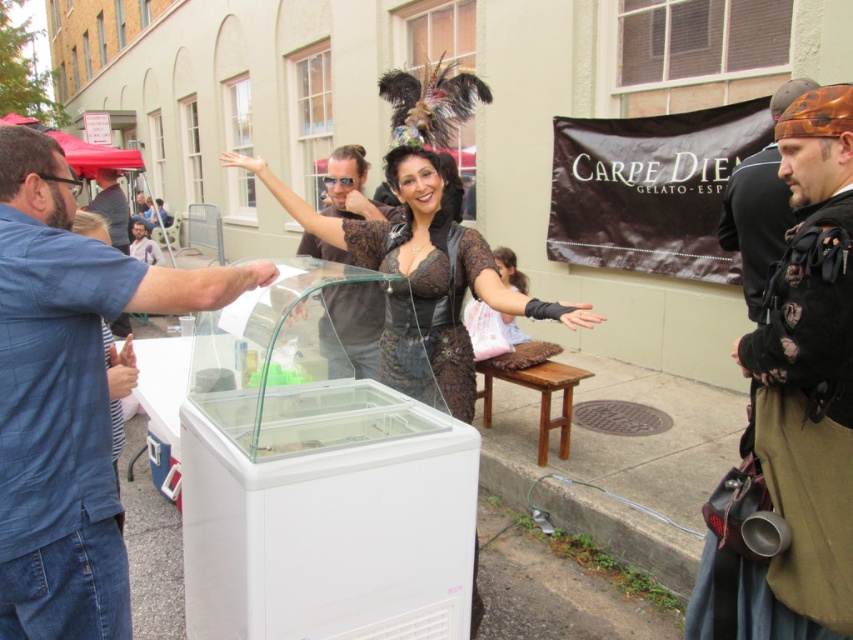
You are standing at the gelato stand and want to reach a point that is 10.69 feet away from you. The coordinates of this point are given as point (250, 170). Can you confirm if this point is within the area of the gelato display freezer?

The distance of point (250, 170) from viewer is 10.69 feet, so yes, the point is within the area of the gelato display freezer.